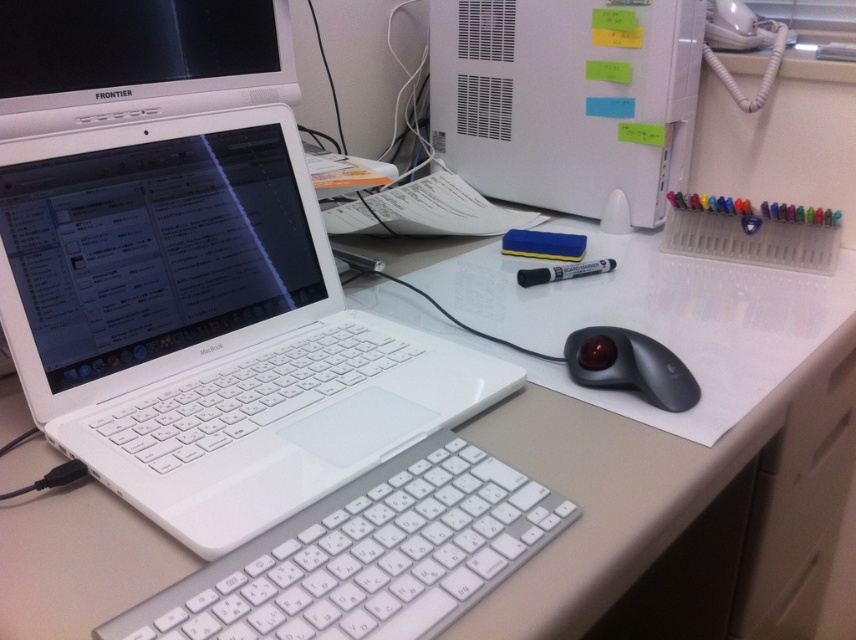
Is white glossy computer monitor at upper left thinner than black rubberized trackball at lower right?

In fact, white glossy computer monitor at upper left might be wider than black rubberized trackball at lower right.

Does white glossy computer monitor at upper left appear under black rubberized trackball at lower right?

Actually, white glossy computer monitor at upper left is above black rubberized trackball at lower right.

Who is more forward, (48, 38) or (651, 369)?

Positioned in front is point (651, 369).

Locate an element on the screen. This screenshot has width=856, height=640. white glossy computer monitor at upper left is located at coordinates pyautogui.click(x=137, y=60).

Does white glossy laptop at left have a lesser height compared to white matte desktop computer at upper center?

Correct, white glossy laptop at left is not as tall as white matte desktop computer at upper center.

Between point (277, 220) and point (638, 51), which one is positioned behind?

Positioned behind is point (638, 51).

Describe the element at coordinates (207, 324) in the screenshot. This screenshot has width=856, height=640. I see `white glossy laptop at left` at that location.

The width and height of the screenshot is (856, 640). Identify the location of white glossy laptop at left. (207, 324).

Can you confirm if white plastic keyboard at center is positioned to the right of black rubberized trackball at lower right?

In fact, white plastic keyboard at center is to the left of black rubberized trackball at lower right.

Is white plastic keyboard at center bigger than black rubberized trackball at lower right?

Yes.

Is point (224, 604) closer to camera compared to point (578, 336)?

Yes, point (224, 604) is closer to viewer.

Where is `white plastic keyboard at center`? white plastic keyboard at center is located at coordinates (367, 556).